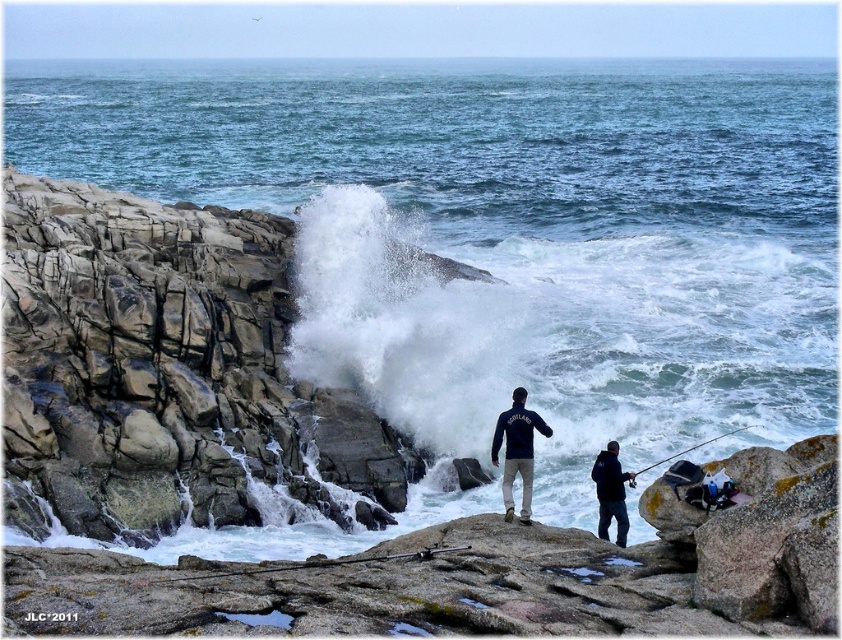
Can you confirm if dark blue fleece jacket at center is bigger than black matte fishing pole at lower right?

Yes, dark blue fleece jacket at center is bigger than black matte fishing pole at lower right.

You are a GUI agent. You are given a task and a screenshot of the screen. Output one action in this format:
    pyautogui.click(x=<x>, y=<y>)
    Task: Click on the dark blue fleece jacket at center
    Image resolution: width=842 pixels, height=640 pixels.
    Given the screenshot: What is the action you would take?
    pyautogui.click(x=517, y=451)

The width and height of the screenshot is (842, 640). Identify the location of dark blue fleece jacket at center. (517, 451).

Which is more to the left, metallic silver fishing pole at center or black matte fishing pole at lower right?

Positioned to the left is metallic silver fishing pole at center.

Does metallic silver fishing pole at center have a greater height compared to black matte fishing pole at lower right?

Correct, metallic silver fishing pole at center is much taller as black matte fishing pole at lower right.

Is point (292, 564) positioned behind point (661, 464)?

That is False.

The height and width of the screenshot is (640, 842). I want to click on metallic silver fishing pole at center, so click(318, 563).

In the scene shown: Measure the distance from dark blue fleece jacket at center to dark blue jacket at lower right.

A distance of 4.94 feet exists between dark blue fleece jacket at center and dark blue jacket at lower right.

Can you confirm if dark blue fleece jacket at center is positioned to the right of dark blue jacket at lower right?

No, dark blue fleece jacket at center is not to the right of dark blue jacket at lower right.

Between point (523, 444) and point (616, 480), which one is positioned behind?

Point (523, 444)

You are a GUI agent. You are given a task and a screenshot of the screen. Output one action in this format:
    pyautogui.click(x=<x>, y=<y>)
    Task: Click on the dark blue fleece jacket at center
    The image size is (842, 640).
    Given the screenshot: What is the action you would take?
    pyautogui.click(x=517, y=451)